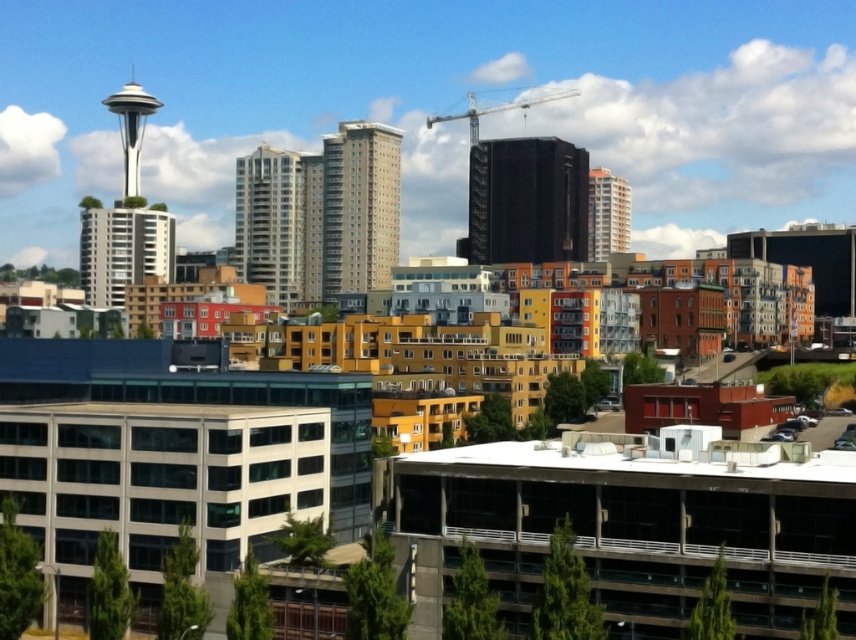
Question: Is beige concrete building at center smaller than polished stainless steel space needle at upper left?

Choices:
 (A) yes
 (B) no

Answer: (A)

Question: Can you confirm if white glossy space needle at upper left is positioned above matte glass building at center?

Choices:
 (A) yes
 (B) no

Answer: (A)

Question: Which object is positioned closest to the black glass building at center?

Choices:
 (A) white glossy space needle at upper left
 (B) white glossy building at center
 (C) beige concrete building at center
 (D) metallic gray crane at upper center

Answer: (D)

Question: Among these points, which one is nearest to the camera?

Choices:
 (A) (428, 122)
 (B) (122, 260)
 (C) (324, 227)

Answer: (C)

Question: Is black glass building at center to the left of beige concrete building at center from the viewer's perspective?

Choices:
 (A) yes
 (B) no

Answer: (B)

Question: Which of these objects is positioned closest to the beige concrete building at center?

Choices:
 (A) black glass building at center
 (B) polished stainless steel space needle at upper left
 (C) matte glass building at center

Answer: (C)